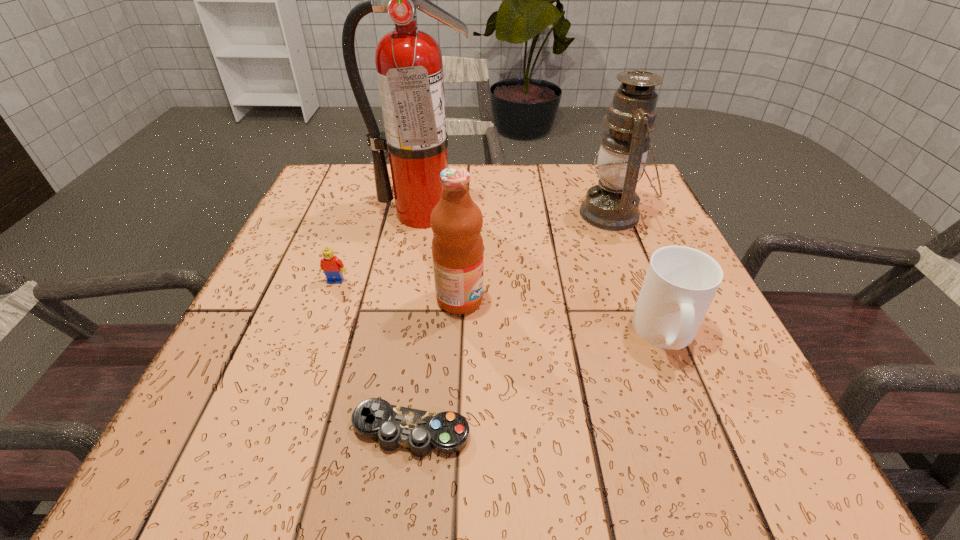
At what (x,y) coordinates should I click in order to perform the action: click on fire extinguisher. Please return your answer as a coordinate pair (x, y). This screenshot has height=540, width=960. Looking at the image, I should click on coord(409,67).

Identify the location of the second tallest object. The width and height of the screenshot is (960, 540). (612, 204).

At what (x,y) coordinates should I click in order to perform the action: click on the fourth shortest object. Please return your answer as a coordinate pair (x, y). Looking at the image, I should click on (457, 245).

Locate an element on the screen. Image resolution: width=960 pixels, height=540 pixels. mug is located at coordinates (680, 283).

In order to click on Lego in this screenshot , I will do `click(333, 267)`.

Image resolution: width=960 pixels, height=540 pixels. What are the coordinates of `the second shortest object` in the screenshot? It's located at (333, 267).

At what (x,y) coordinates should I click in order to perform the action: click on the shortest object. Please return your answer as a coordinate pair (x, y). The height and width of the screenshot is (540, 960). Looking at the image, I should click on (447, 432).

The width and height of the screenshot is (960, 540). Find the location of `control`. control is located at coordinates (447, 432).

Find the location of a particular element. This screenshot has height=540, width=960. vacant space located 0.220m on the nozzle side of the fire extinguisher is located at coordinates (408, 295).

Image resolution: width=960 pixels, height=540 pixels. In order to click on free region located on the left of the oil lamp in this screenshot , I will do pos(486,214).